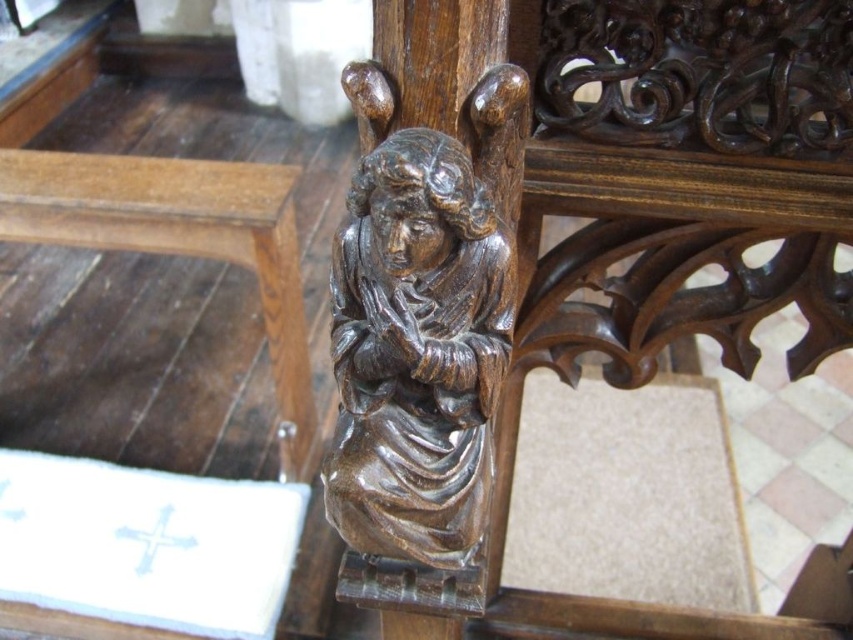
You are an interior designer assessing the spatial compatibility of items in a sacred space. The polished dark wood angel at center and the brown wood table at lower left are part of the design. Given their sizes, which object would you consider more suitable for placement in a smaller niche area within the space?

The polished dark wood angel at center has a smaller size compared to the brown wood table at lower left, making it more suitable for placement in a smaller niche area within the space.

You are an interior designer assessing the placement of the polished dark wood angel at center and the brown wood table at lower left. Based on their heights, which object would you need to adjust to ensure both are visible from a seated position?

The polished dark wood angel at center has a lesser height compared to brown wood table at lower left. To ensure both are visible from a seated position, you would need to raise the polished dark wood angel at center so it reaches the same height as the brown wood table at lower left.